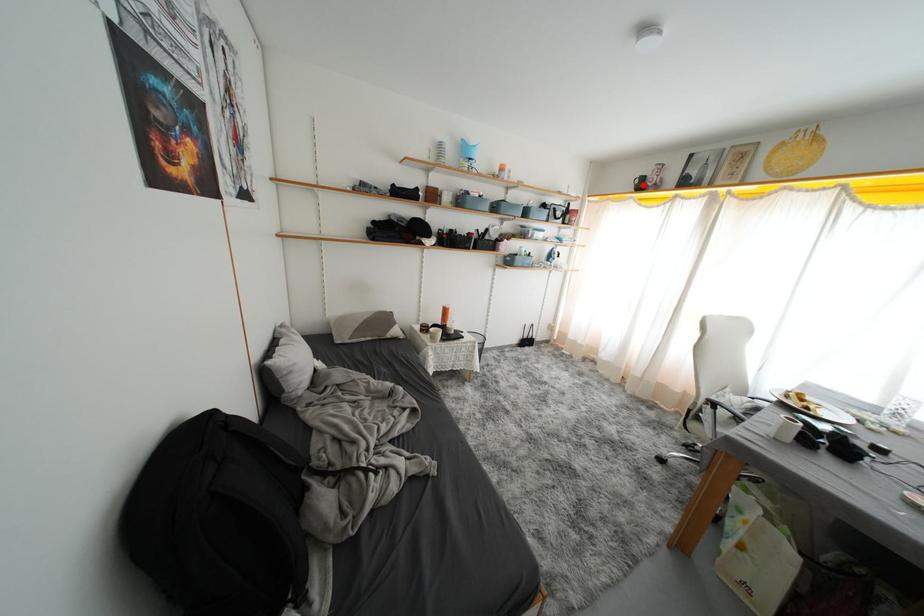
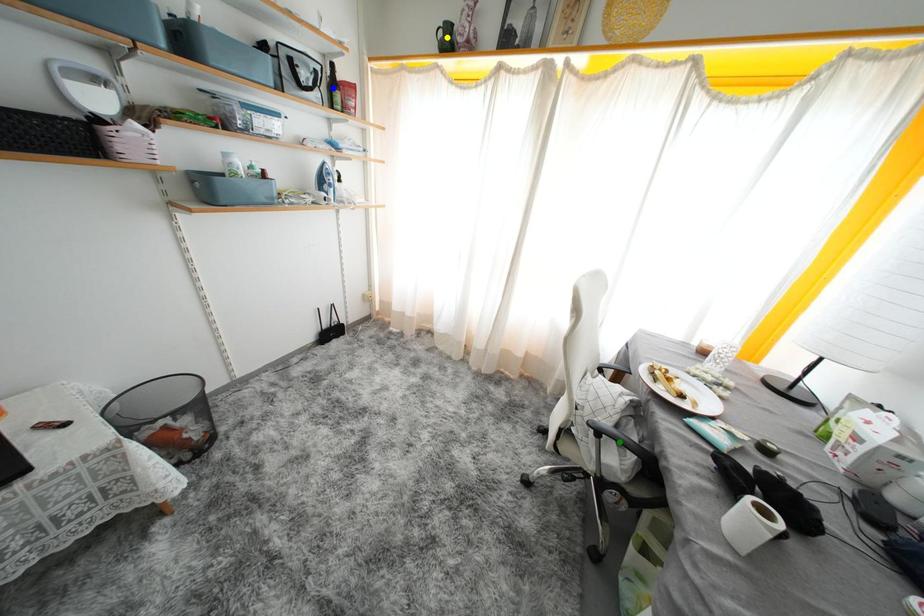
Question: I am providing you with two images of the same scene from different viewpoints. A red point is marked on the first image. You are given multiple points on the second image. In image 2, which mark is for the same physical point as the one in image 1?

Choices:
 (A) blue point
 (B) yellow point
 (C) green point

Answer: (B)